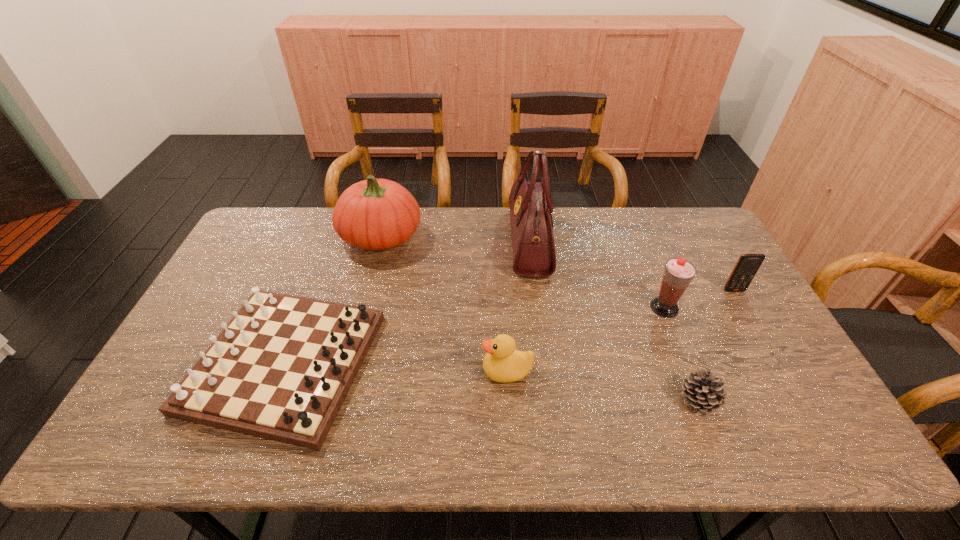
Where is `handbag`? The image size is (960, 540). handbag is located at coordinates (530, 203).

Find the location of a particular element. pumpkin is located at coordinates (375, 214).

You are a GUI agent. You are given a task and a screenshot of the screen. Output one action in this format:
    pyautogui.click(x=<x>, y=<y>)
    Task: Click on the fifth shortest object
    
    Given the screenshot: What is the action you would take?
    pyautogui.click(x=678, y=273)

Locate an element on the screen. The image size is (960, 540). cellular telephone is located at coordinates (748, 264).

This screenshot has width=960, height=540. What are the coordinates of `the fifth nearest object` in the screenshot? It's located at (748, 264).

Locate an element on the screen. duck is located at coordinates (502, 363).

This screenshot has height=540, width=960. What are the coordinates of `pinecone` in the screenshot? It's located at (703, 392).

At what (x,y) coordinates should I click in order to perform the action: click on chessboard. Please return your answer as a coordinate pair (x, y). Looking at the image, I should click on (281, 369).

At what (x,y) coordinates should I click in order to perform the action: click on vacant space situated on the front-facing side of the tallest object. Please return your answer as a coordinate pair (x, y). Looking at the image, I should click on (394, 242).

I want to click on free spot located on the front-facing side of the tallest object, so click(x=478, y=242).